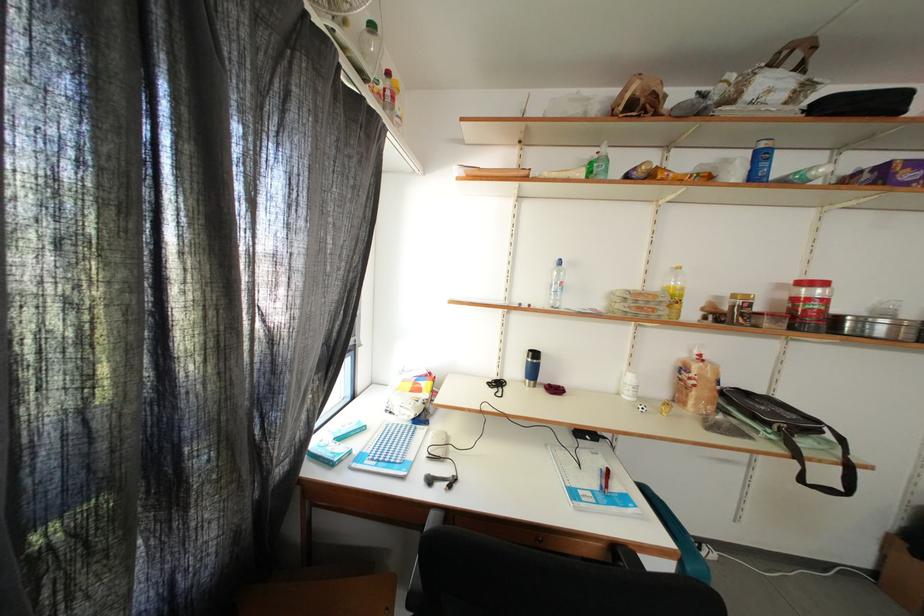
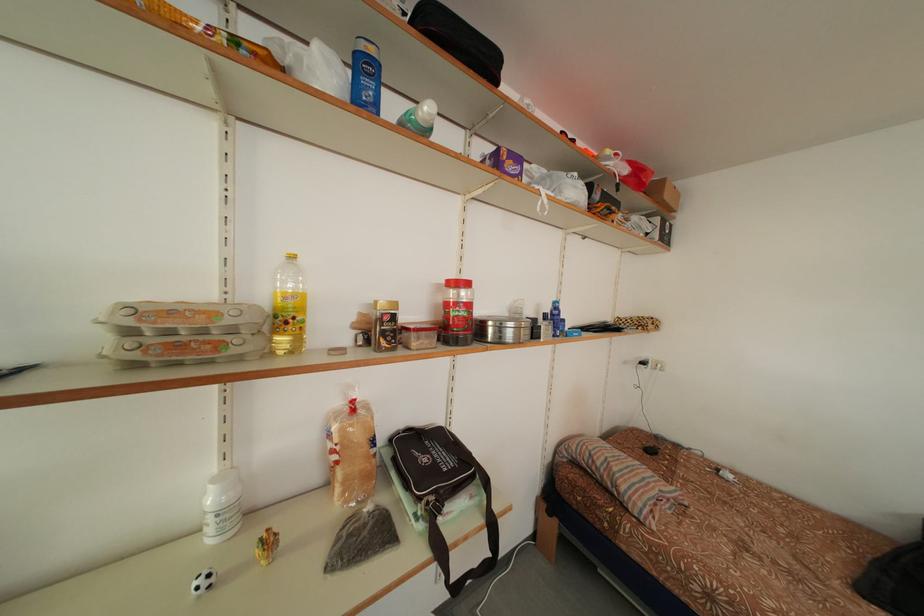
Where in the second image is the point corresponding to point 857,330 from the first image?

(499, 334)